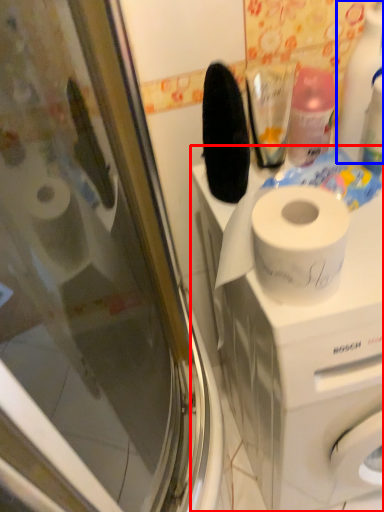
Question: Which object appears farthest to the camera in this image, washing machine (highlighted by a red box) or cleaning product (highlighted by a blue box)?

Choices:
 (A) washing machine
 (B) cleaning product

Answer: (B)